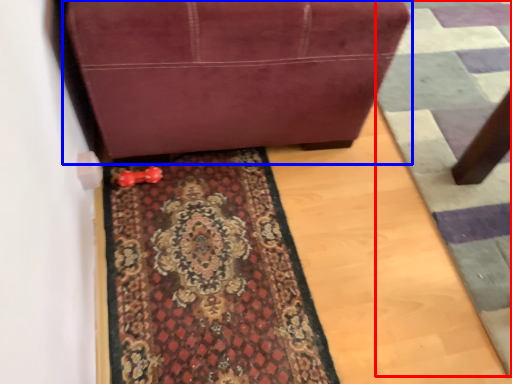
Question: Which object is closer to the camera taking this photo, doormat (highlighted by a red box) or furniture (highlighted by a blue box)?

Choices:
 (A) doormat
 (B) furniture

Answer: (B)